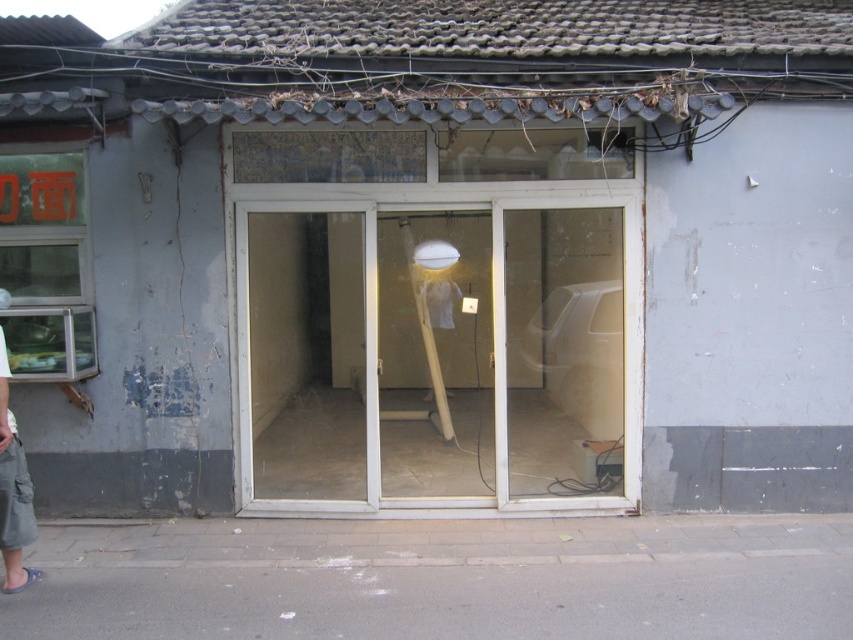
Question: From the image, what is the correct spatial relationship of transparent glass window at left in relation to gray cotton skirt at lower left?

Choices:
 (A) right
 (B) left

Answer: (B)

Question: Based on their relative distances, which object is nearer to the gray cotton skirt at lower left?

Choices:
 (A) white plastic screen door at center
 (B) transparent glass door at center
 (C) transparent plastic screen door at center

Answer: (B)

Question: Can you confirm if white plastic screen door at center is wider than transparent plastic screen door at center?

Choices:
 (A) yes
 (B) no

Answer: (B)

Question: Which of the following is the closest to the observer?

Choices:
 (A) transparent plastic screen door at center
 (B) gray cotton skirt at lower left
 (C) white plastic screen door at center
 (D) transparent glass window at left

Answer: (B)

Question: Does white plastic screen door at center have a smaller size compared to transparent glass door at center?

Choices:
 (A) no
 (B) yes

Answer: (B)

Question: Which point is closer to the camera?

Choices:
 (A) (44, 220)
 (B) (601, 204)
 (C) (20, 448)

Answer: (C)